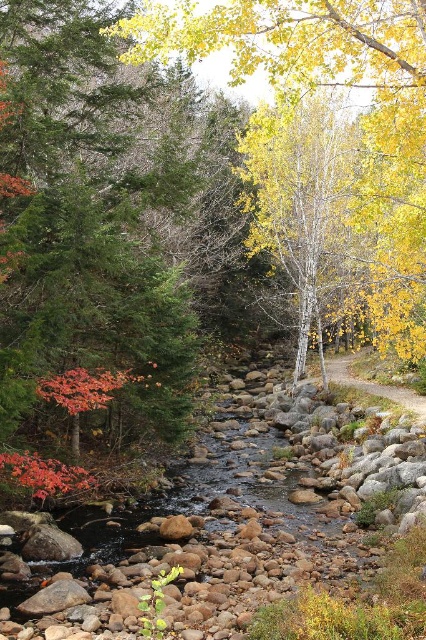
Is smooth white birch at center behind brown dirt path at center-right?

Yes, smooth white birch at center is further from the viewer.

Is point (314, 305) farther from viewer compared to point (354, 355)?

No.

Where is `smooth white birch at center`? This screenshot has width=426, height=640. smooth white birch at center is located at coordinates (301, 196).